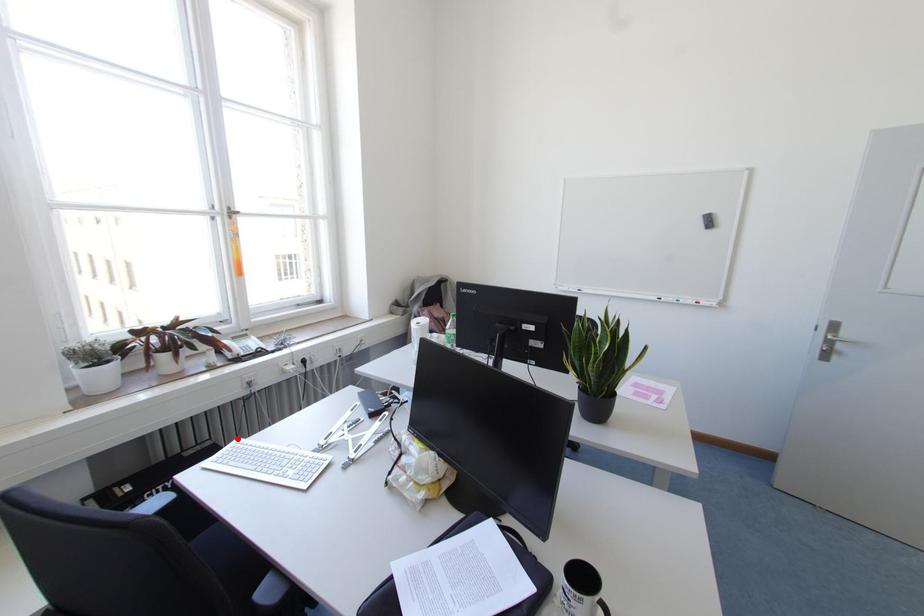
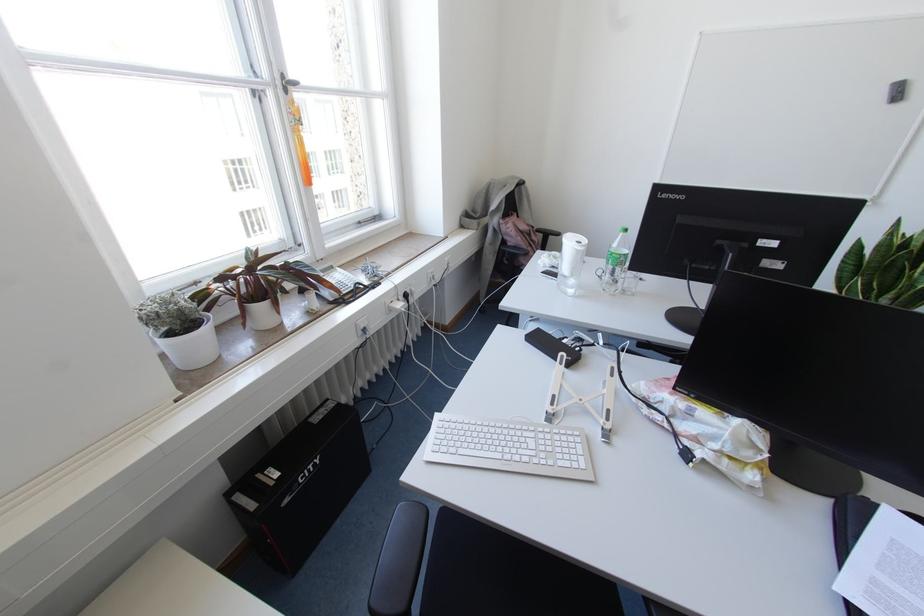
In the second image, find the point that corresponds to the highlighted location in the first image.

(435, 414)